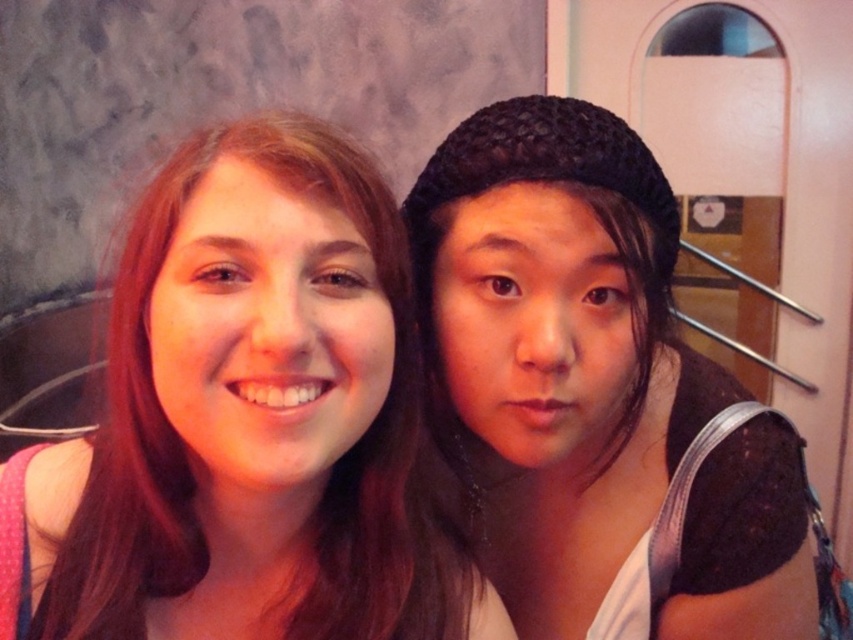
From the picture: Measure the distance between matte pink shirt at left and black knitted hat at right.

6.39 inches

Between matte pink shirt at left and black knitted hat at right, which one appears on the left side from the viewer's perspective?

Positioned to the left is matte pink shirt at left.

Identify the location of matte pink shirt at left. pyautogui.click(x=247, y=420).

Locate an element on the screen. matte pink shirt at left is located at coordinates (247, 420).